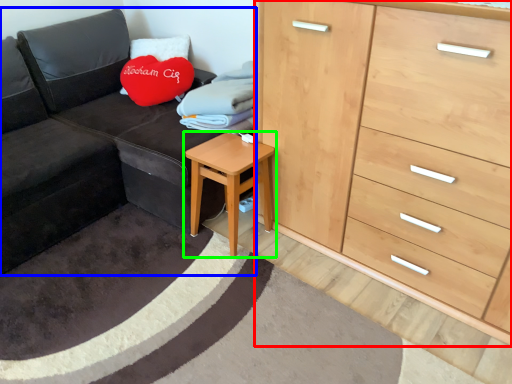
Question: Which is farther away from chest of drawers (highlighted by a red box)? studio couch (highlighted by a blue box) or table (highlighted by a green box)?

Choices:
 (A) studio couch
 (B) table

Answer: (A)